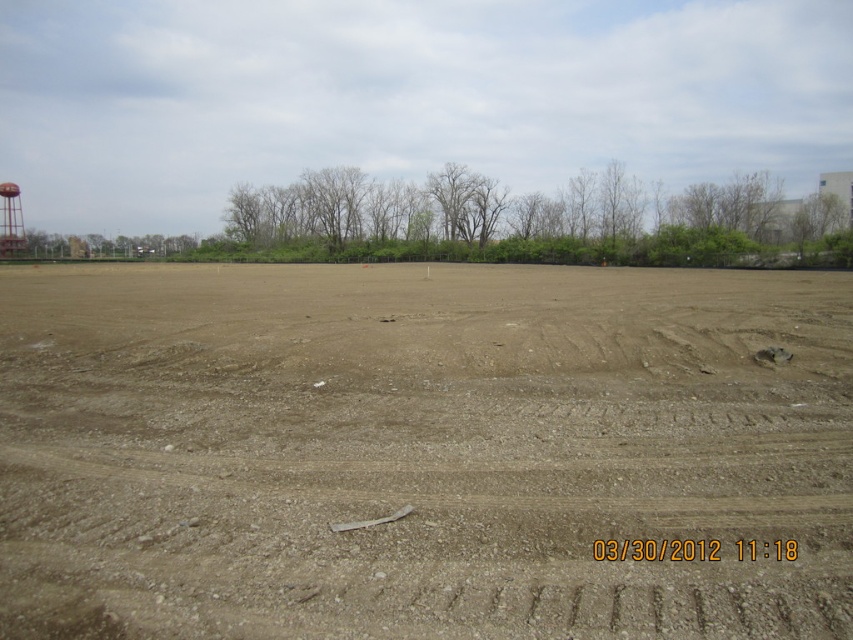
Question: Does brown sandy dirt at center appear over green leafy trees at center?

Choices:
 (A) yes
 (B) no

Answer: (B)

Question: From the image, what is the correct spatial relationship of green leafy trees at center in relation to metallic water tower at left?

Choices:
 (A) above
 (B) below

Answer: (A)

Question: Which object is the farthest from the green leafy trees at center?

Choices:
 (A) brown sandy dirt at center
 (B) metallic water tower at left

Answer: (A)

Question: Estimate the real-world distances between objects in this image. Which object is closer to the brown sandy dirt at center?

Choices:
 (A) metallic water tower at left
 (B) green leafy trees at center

Answer: (B)

Question: Which point is farther to the camera?

Choices:
 (A) green leafy trees at center
 (B) brown sandy dirt at center
 (C) metallic water tower at left

Answer: (C)

Question: Does brown sandy dirt at center appear on the right side of metallic water tower at left?

Choices:
 (A) yes
 (B) no

Answer: (A)